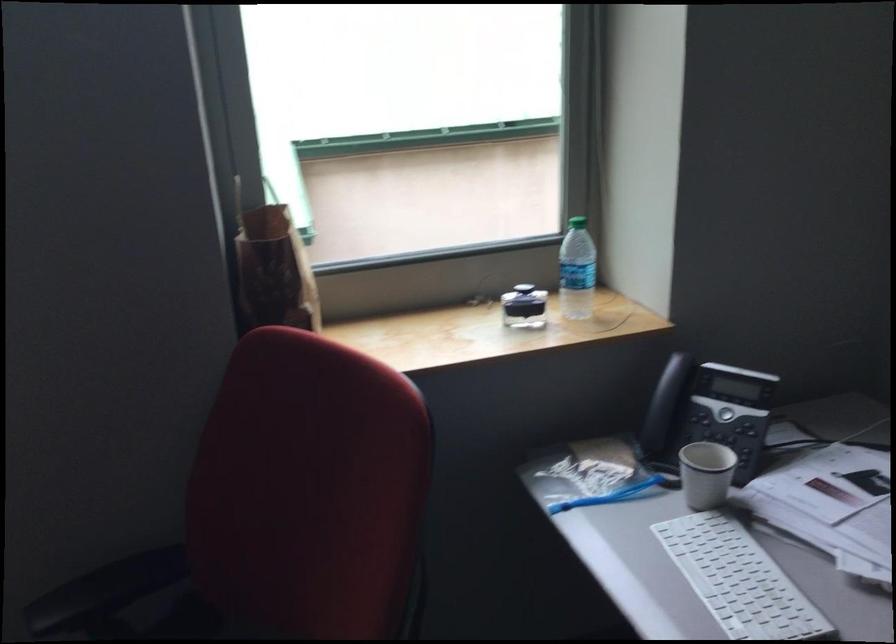
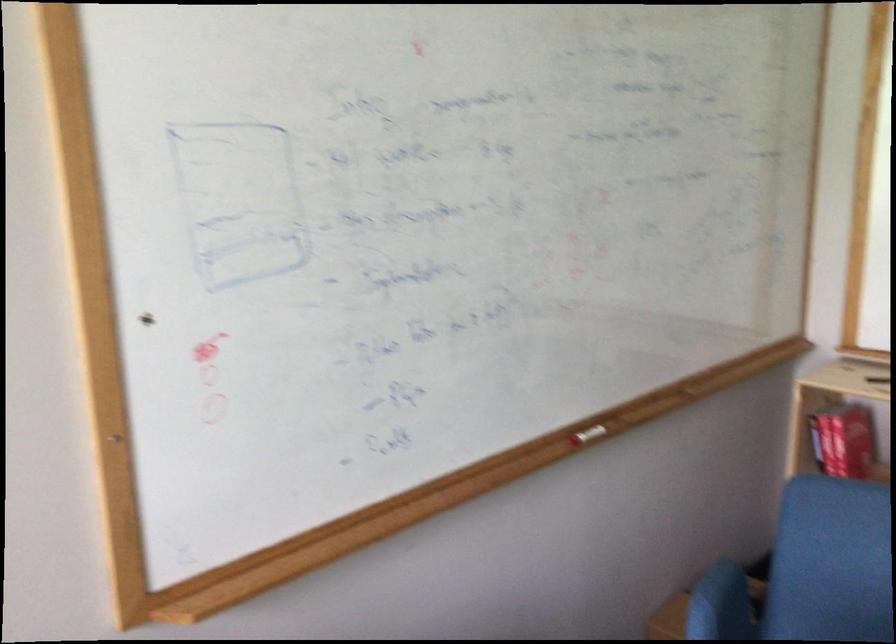
How did the camera likely rotate?

The camera rotated toward right-down.